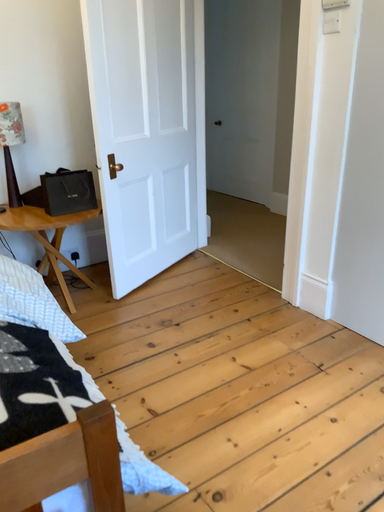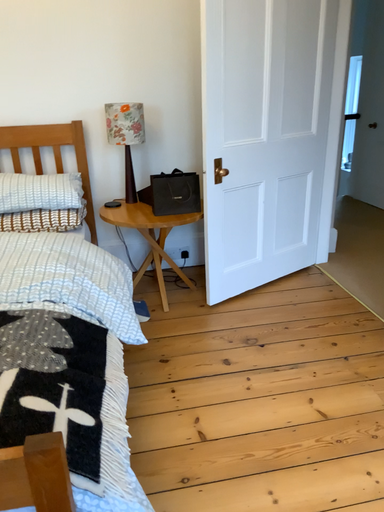
Question: Which way did the camera rotate in the video?

Choices:
 (A) rotated right
 (B) rotated left

Answer: (B)